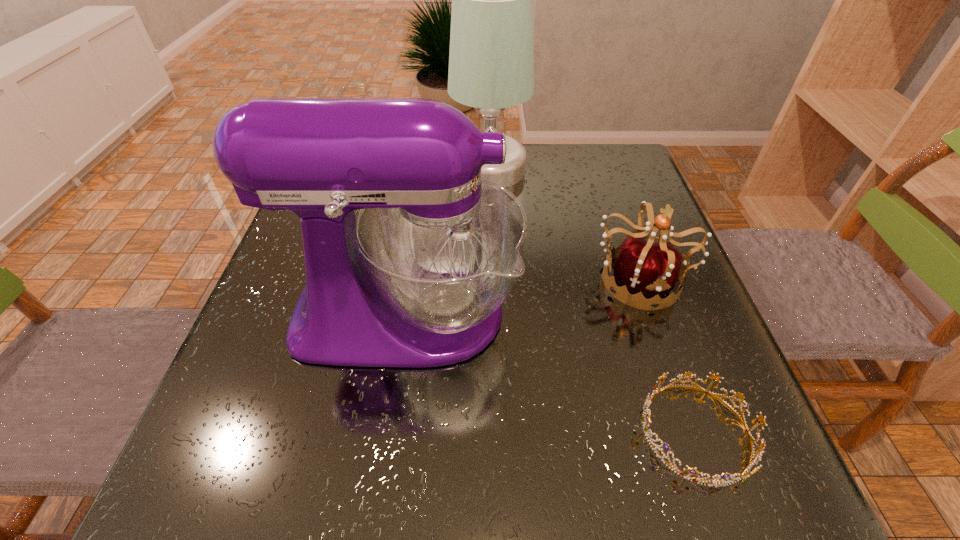
You are a GUI agent. You are given a task and a screenshot of the screen. Output one action in this format:
    pyautogui.click(x=<x>, y=<y>)
    Task: Click on the free spot located on the front-facing side of the second shortest object
    This screenshot has width=960, height=540.
    Given the screenshot: What is the action you would take?
    pyautogui.click(x=689, y=422)

This screenshot has height=540, width=960. What are the coordinates of `free space located 0.380m on the front-facing side of the shorter tiara` in the screenshot? It's located at (395, 431).

Locate an element on the screen. The width and height of the screenshot is (960, 540). vacant region located 0.380m on the front-facing side of the shorter tiara is located at coordinates (395, 431).

I want to click on vacant point located 0.380m on the front-facing side of the shorter tiara, so click(x=395, y=431).

What are the coordinates of `object situated at the far edge` in the screenshot? It's located at pyautogui.click(x=491, y=62).

Locate an element on the screen. object at the near edge is located at coordinates (757, 457).

Identify the location of object that is at the left edge. The height and width of the screenshot is (540, 960). (417, 279).

Locate an element on the screen. object that is at the near right corner is located at coordinates (757, 457).

Find the location of a particular element. The width and height of the screenshot is (960, 540). free space at the far edge of the desktop is located at coordinates (573, 161).

Locate an element on the screen. Image resolution: width=960 pixels, height=540 pixels. vacant space at the near edge of the desktop is located at coordinates (413, 450).